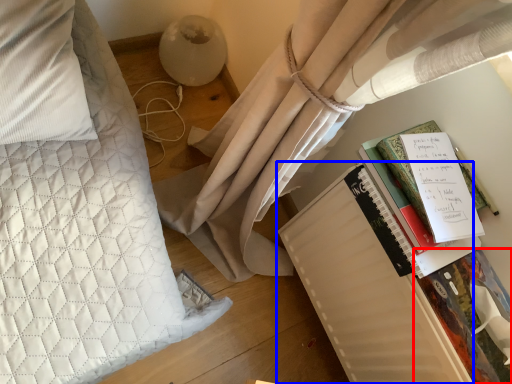
Question: Which point is further to the camera, paperback book (highlighted by a red box) or paperback book (highlighted by a blue box)?

Choices:
 (A) paperback book
 (B) paperback book

Answer: (B)